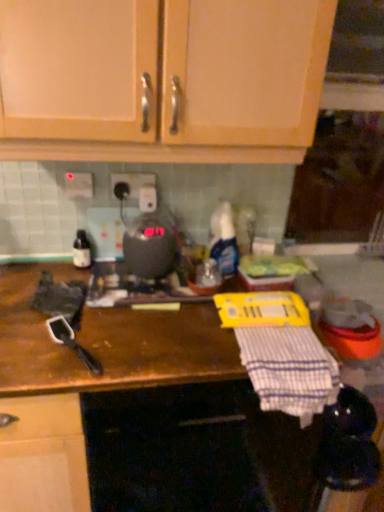
You are a GUI agent. You are given a task and a screenshot of the screen. Output one action in this format:
    pyautogui.click(x=<x>, y=<y>)
    Task: Click on the vacant area situated below metallic gray toaster at center (from a real-world perspective)
    This screenshot has width=384, height=512.
    Given the screenshot: What is the action you would take?
    click(150, 271)